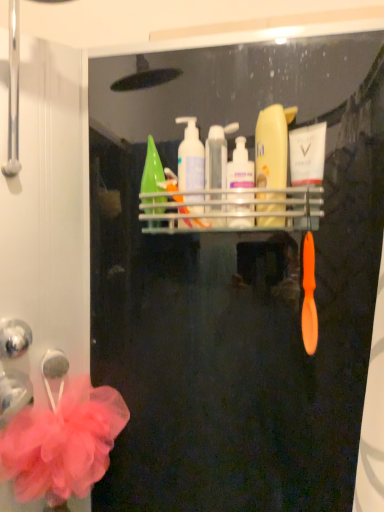
Question: Is translucent plastic pump bottle at upper center, the second cleaning product positioned from the left, oriented towards matte yellow bottle at center, marked as the 4th cleaning product in a left-to-right arrangement?

Choices:
 (A) no
 (B) yes

Answer: (A)

Question: Is translucent plastic pump bottle at upper center, the 3th cleaning product positioned from the right, outside of matte yellow bottle at center, marked as the 4th cleaning product in a left-to-right arrangement?

Choices:
 (A) yes
 (B) no

Answer: (A)

Question: From the image's perspective, is translucent plastic pump bottle at upper center, the 3th cleaning product positioned from the right, above matte yellow bottle at center, marked as the 4th cleaning product in a left-to-right arrangement?

Choices:
 (A) yes
 (B) no

Answer: (B)

Question: Can you see translucent plastic pump bottle at upper center, the second cleaning product positioned from the left, touching matte yellow bottle at center, marked as the 4th cleaning product in a left-to-right arrangement?

Choices:
 (A) yes
 (B) no

Answer: (B)

Question: Can matte yellow bottle at center, marked as the 4th cleaning product in a left-to-right arrangement, be found inside translucent plastic pump bottle at upper center, the 3th cleaning product positioned from the right?

Choices:
 (A) no
 (B) yes

Answer: (A)

Question: Based on their sizes in the image, would you say white glossy mouthwash at upper center, which is the second mouthwash from left to right, is bigger or smaller than green matte bottle at center, positioned as the fourth cleaning product in right-to-left order?

Choices:
 (A) small
 (B) big

Answer: (A)

Question: Considering the positions of white glossy mouthwash at upper center, which is the second mouthwash from left to right, and green matte bottle at center, which ranks as the 1th cleaning product in left-to-right order, in the image, is white glossy mouthwash at upper center, which is the second mouthwash from left to right, taller or shorter than green matte bottle at center, which ranks as the 1th cleaning product in left-to-right order,?

Choices:
 (A) short
 (B) tall

Answer: (A)

Question: Considering the positions of white glossy mouthwash at upper center, the first mouthwash from the right, and green matte bottle at center, positioned as the fourth cleaning product in right-to-left order, in the image, is white glossy mouthwash at upper center, the first mouthwash from the right, wider or thinner than green matte bottle at center, positioned as the fourth cleaning product in right-to-left order,?

Choices:
 (A) thin
 (B) wide

Answer: (A)

Question: Is white glossy mouthwash at upper center, the first mouthwash from the right, spatially inside green matte bottle at center, which ranks as the 1th cleaning product in left-to-right order, or outside of it?

Choices:
 (A) inside
 (B) outside

Answer: (B)

Question: From the image's perspective, is white glossy mouthwash at upper center, which is the second mouthwash from left to right, located above or below matte yellow bottle at center, marked as the 4th cleaning product in a left-to-right arrangement?

Choices:
 (A) above
 (B) below

Answer: (B)

Question: In terms of height, does white glossy mouthwash at upper center, which is the second mouthwash from left to right, look taller or shorter compared to matte yellow bottle at center, marked as the 4th cleaning product in a left-to-right arrangement?

Choices:
 (A) short
 (B) tall

Answer: (A)

Question: Considering the positions of point (306, 178) and point (266, 177), is point (306, 178) closer or farther from the camera than point (266, 177)?

Choices:
 (A) farther
 (B) closer

Answer: (A)

Question: From a real-world perspective, is white glossy mouthwash at upper center, which is the second mouthwash from left to right, physically located above or below matte yellow bottle at center, the first cleaning product positioned from the right?

Choices:
 (A) above
 (B) below

Answer: (B)

Question: Would you say white glossy mouthwash at upper center, which is the second mouthwash from left to right, is inside or outside translucent plastic mouthwash at center, marked as the 1th mouthwash in a left-to-right arrangement?

Choices:
 (A) inside
 (B) outside

Answer: (B)

Question: Is white glossy mouthwash at upper center, the first mouthwash from the right, in front of or behind translucent plastic mouthwash at center, the second mouthwash from the right, in the image?

Choices:
 (A) front
 (B) behind

Answer: (A)